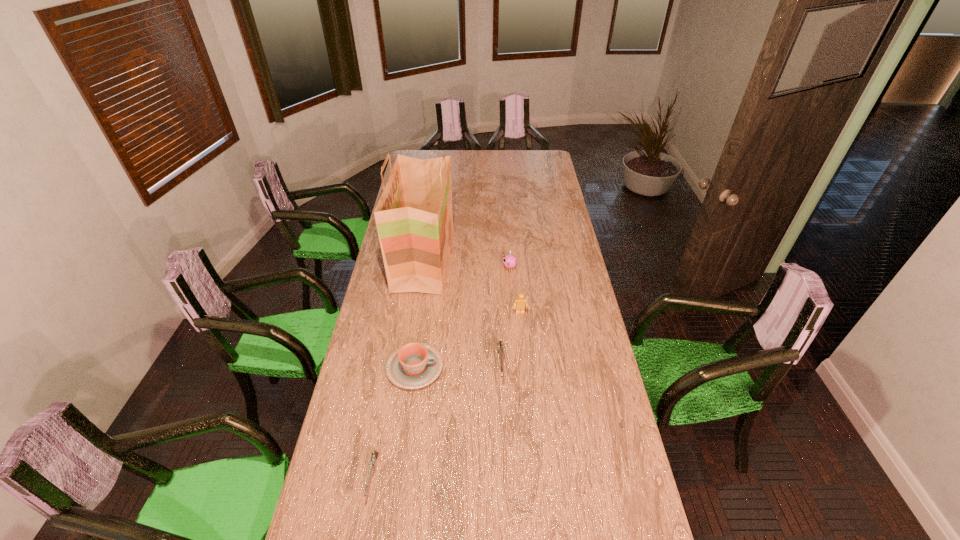
Please point a free position for a pistol on the right. Please provide its 2D coordinates. Your answer should be formatted as a tuple, i.e. [(x, y)], where the tuple contains the x and y coordinates of a point satisfying the conditions above.

[(588, 289)]